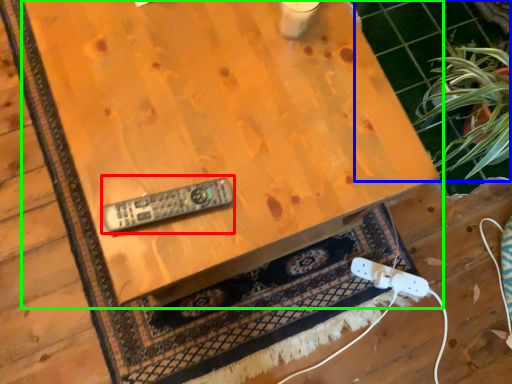
Question: Estimate the real-world distances between objects in this image. Which object is closer to control (highlighted by a red box), tile (highlighted by a blue box) or table (highlighted by a green box)?

Choices:
 (A) tile
 (B) table

Answer: (B)